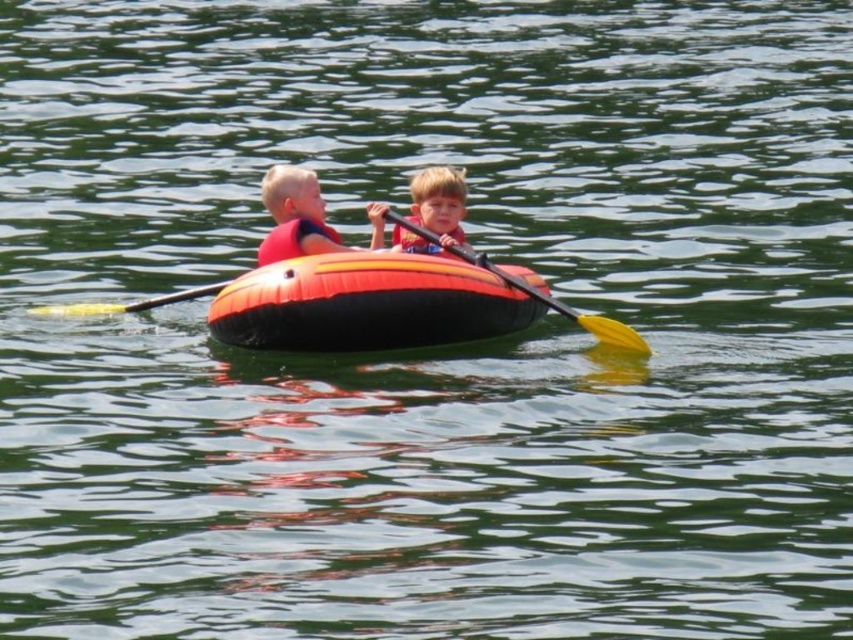
Who is lower down, matte red life vest at center or matte blue life jacket at center?

matte blue life jacket at center

Find the location of a particular element. matte red life vest at center is located at coordinates (294, 216).

From the picture: Which is above, orange matte inflatable boat at center or matte red life vest at center?

matte red life vest at center is higher up.

Does orange matte inflatable boat at center appear under matte red life vest at center?

Yes, orange matte inflatable boat at center is below matte red life vest at center.

Between point (230, 342) and point (305, 230), which one is positioned behind?

Positioned behind is point (305, 230).

Locate an element on the screen. The width and height of the screenshot is (853, 640). orange matte inflatable boat at center is located at coordinates (366, 304).

This screenshot has height=640, width=853. I want to click on red matte life jacket at center, so click(291, 240).

Can you confirm if red matte life jacket at center is positioned to the right of yellow foam paddle at center?

Correct, you'll find red matte life jacket at center to the right of yellow foam paddle at center.

Does point (270, 256) come closer to viewer compared to point (160, 305)?

Yes, point (270, 256) is in front of point (160, 305).

You are a GUI agent. You are given a task and a screenshot of the screen. Output one action in this format:
    pyautogui.click(x=<x>, y=<y>)
    Task: Click on the red matte life jacket at center
    This screenshot has width=853, height=640.
    Given the screenshot: What is the action you would take?
    pyautogui.click(x=291, y=240)